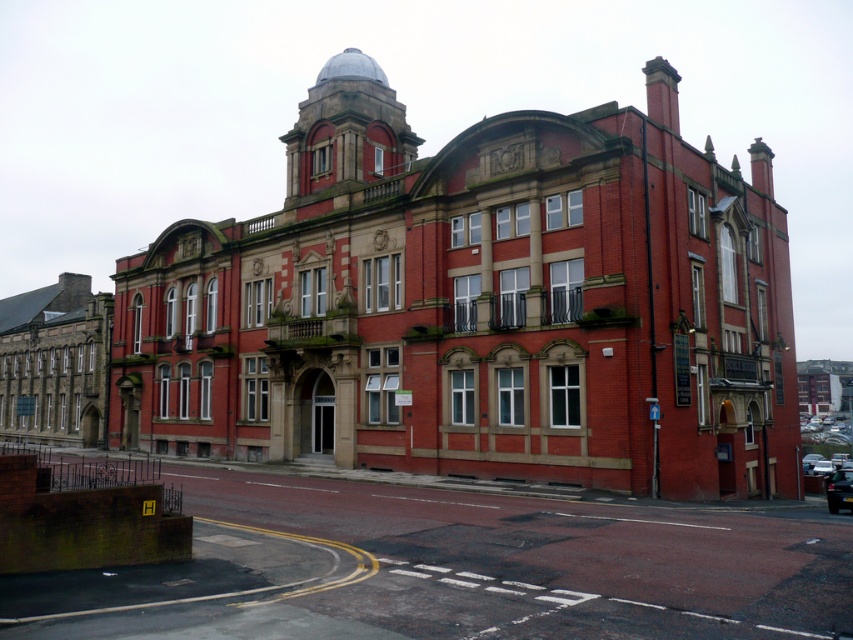
Question: Is black glossy car at center above metallic silver car at center?

Choices:
 (A) no
 (B) yes

Answer: (B)

Question: Which point is closer to the camera?

Choices:
 (A) coord(802,461)
 (B) coord(836,497)

Answer: (B)

Question: Observing the image, what is the correct spatial positioning of black glossy car at center in reference to metallic silver car at center?

Choices:
 (A) above
 (B) below

Answer: (A)

Question: From the image, what is the correct spatial relationship of black glossy car at center in relation to metallic silver car at center?

Choices:
 (A) above
 (B) below

Answer: (A)